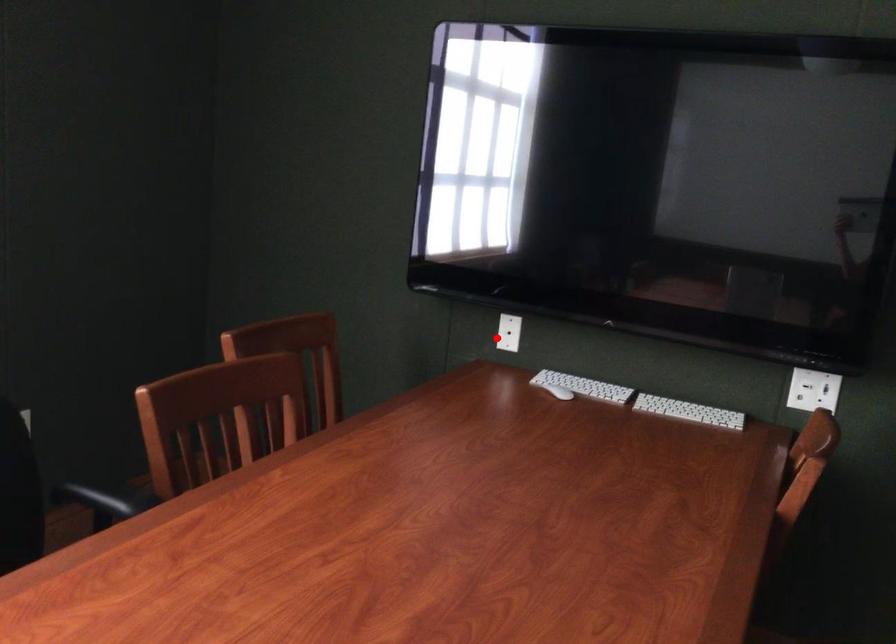
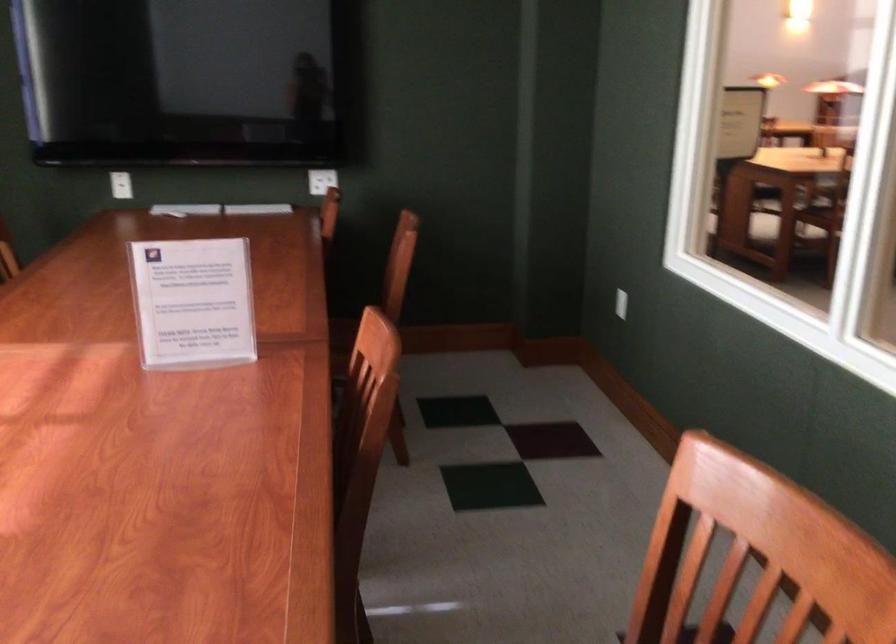
Question: I am providing you with two images of the same scene from different viewpoints. A red point is shown in image1. For the corresponding object point in image2, is it positioned nearer or farther from the camera?

Choices:
 (A) Nearer
 (B) Farther

Answer: (B)